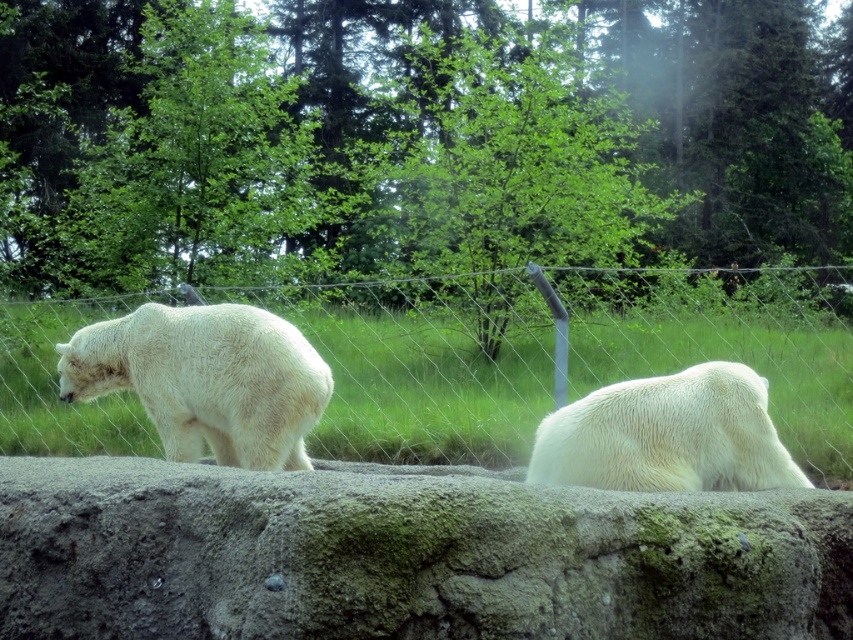
You are a zookeeper planning to install a new feeding station between the wire mesh fence at center and the white fluffy bear at left. To ensure safety, the feeding station must be placed where the space is wider than the bear. Based on the scene, is the space between them suitable for this requirement?

The wire mesh fence at center is wider than the white fluffy bear at left, so the space between them is suitable for placing the feeding station as it meets the width requirement.

You are a zookeeper trying to place a new feeding station between the two polar bears. The mossy concrete boulder at center is in the way. Can you move the boulder to the right side of the enclosure to clear the path?

The mossy concrete boulder at center is located at point (x=405, y=556), so moving it to the right side would require checking if there is enough space. However, since the coordinates are given as a point, it might be a specific location that cannot be easily moved. Consult the zoo maintenance team for assistance.